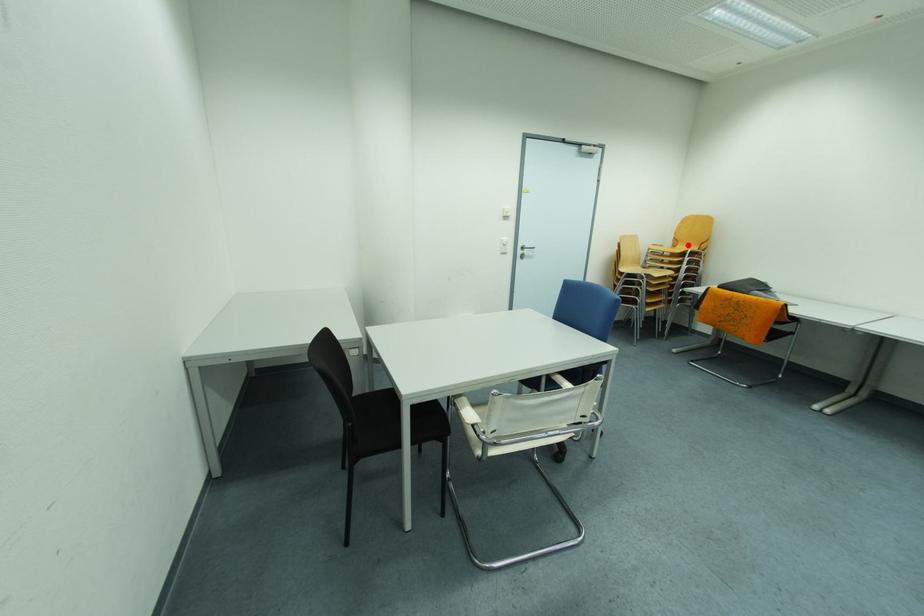
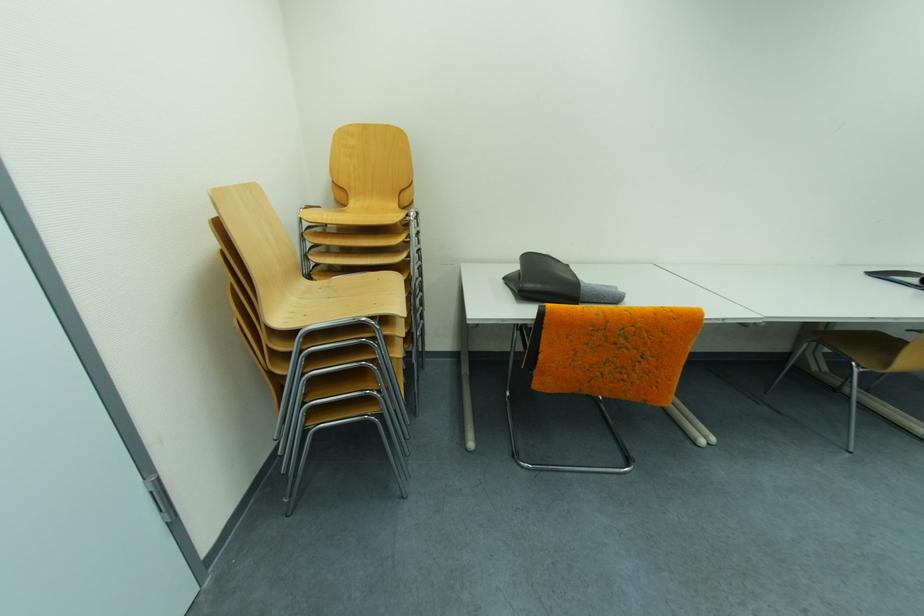
Find the pixel in the second image that matches the highlighted location in the first image.

(359, 197)